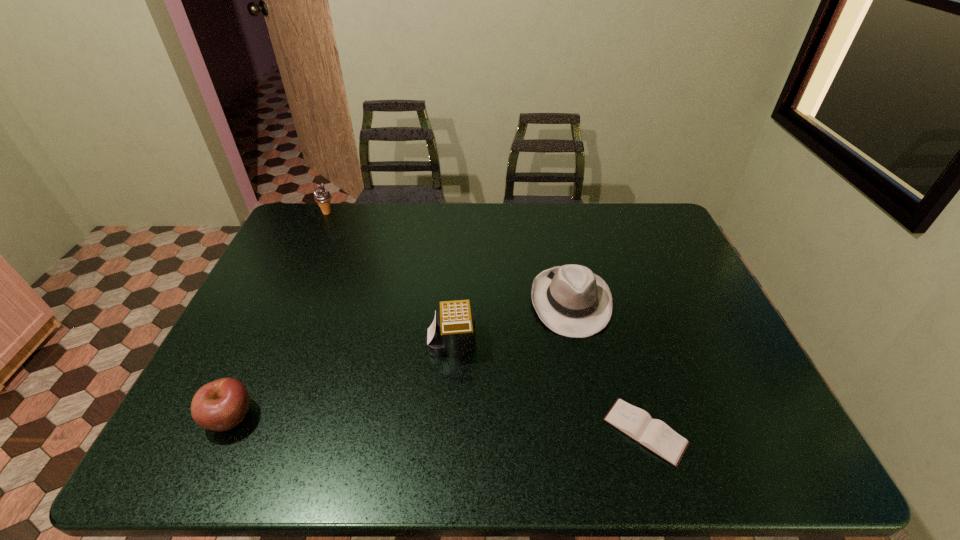
Identify the location of object present at the far edge. (322, 196).

This screenshot has width=960, height=540. In order to click on apple that is at the near edge in this screenshot , I will do `click(220, 405)`.

The width and height of the screenshot is (960, 540). In order to click on diary situated at the near edge in this screenshot , I will do `click(655, 435)`.

At what (x,y) coordinates should I click in order to perform the action: click on icecream present at the left edge. Please return your answer as a coordinate pair (x, y). The height and width of the screenshot is (540, 960). Looking at the image, I should click on (x=322, y=196).

At what (x,y) coordinates should I click in order to perform the action: click on apple at the left edge. Please return your answer as a coordinate pair (x, y). The height and width of the screenshot is (540, 960). Looking at the image, I should click on (220, 405).

Identify the location of object that is positioned at the far left corner. (322, 196).

Find the location of a particular element. object situated at the near left corner is located at coordinates pos(220,405).

In the image, there is a desktop. Where is `free region at the far edge`? Image resolution: width=960 pixels, height=540 pixels. free region at the far edge is located at coordinates (388, 241).

Where is `free space at the near edge of the desktop`? The height and width of the screenshot is (540, 960). free space at the near edge of the desktop is located at coordinates (474, 455).

Image resolution: width=960 pixels, height=540 pixels. What are the coordinates of `free space at the left edge of the desktop` in the screenshot? It's located at (292, 269).